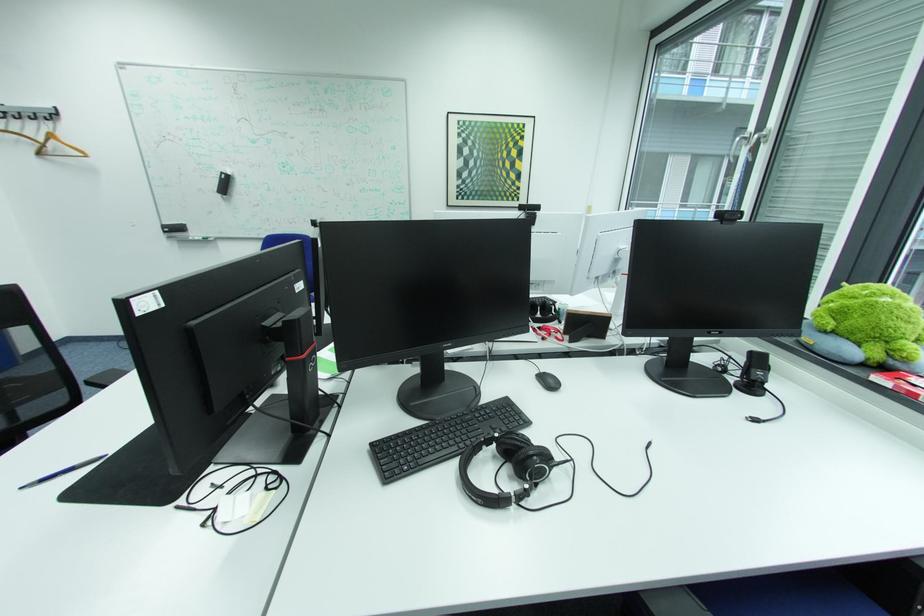
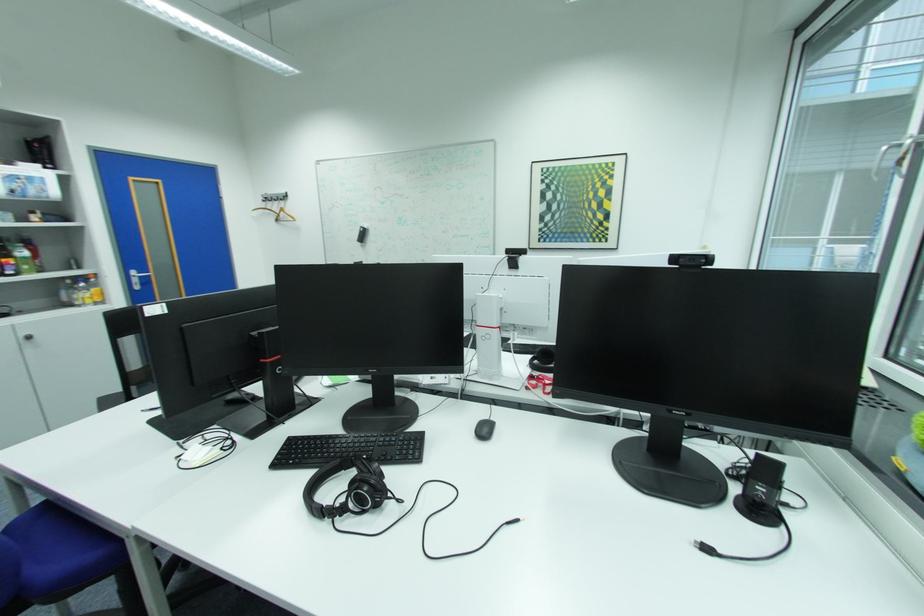
Question: The images are taken continuously from a first-person perspective. In which direction are you moving?

Choices:
 (A) Left
 (B) Right
 (C) Forward
 (D) Backward

Answer: (B)